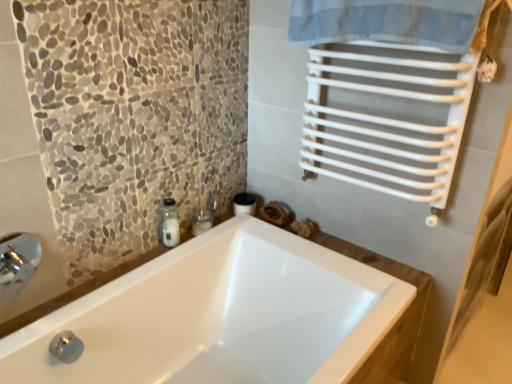
The image size is (512, 384). I want to click on free space to the right of clear glass jar at center, so click(242, 236).